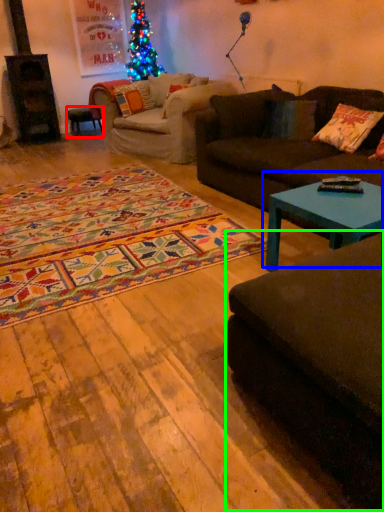
Question: Based on their relative distances, which object is nearer to stool (highlighted by a red box)? Choose from coffee table (highlighted by a blue box) and studio couch (highlighted by a green box).

Choices:
 (A) coffee table
 (B) studio couch

Answer: (A)